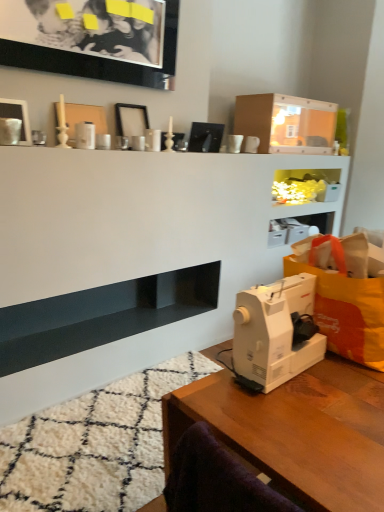
Looking at this image, in order to face orange fabric grocery bag at right, should I rotate leftwards or rightwards?

You should rotate right by 20.301 degrees.

Where is `orange fabric grocery bag at right`? The width and height of the screenshot is (384, 512). orange fabric grocery bag at right is located at coordinates (344, 295).

Where is `black glossy picture frame at upper left, marked as the 3th picture frame in a bottom-to-top arrangement`? This screenshot has width=384, height=512. black glossy picture frame at upper left, marked as the 3th picture frame in a bottom-to-top arrangement is located at coordinates (99, 60).

What do you see at coordinates (131, 120) in the screenshot?
I see `white matte picture frame at upper center, which ranks as the second picture frame in bottom-to-top order` at bounding box center [131, 120].

The width and height of the screenshot is (384, 512). I want to click on white glossy picture frame at upper left, which is counted as the third picture frame, starting from the top, so click(17, 117).

The image size is (384, 512). Describe the element at coordinates (296, 432) in the screenshot. I see `wooden table at lower right` at that location.

In order to face wooden table at lower right, should I rotate leftwards or rightwards?

You should rotate right by 13.479 degrees.

At what (x,y) coordinates should I click in order to perform the action: click on matte cardboard box at upper center. Please return your answer as a coordinate pair (x, y). Image resolution: width=384 pixels, height=512 pixels. Looking at the image, I should click on (286, 123).

From the image's perspective, between wooden table at lower right and translucent plastic cabinet at upper center, which one is located above?

translucent plastic cabinet at upper center, from the image's perspective.

Is wooden table at lower right completely or partially outside of translucent plastic cabinet at upper center?

That's correct, wooden table at lower right is outside of translucent plastic cabinet at upper center.

From a real-world perspective, is wooden table at lower right physically above translucent plastic cabinet at upper center?

No.

Which object is closer to the camera, wooden table at lower right or translucent plastic cabinet at upper center?

wooden table at lower right.

Considering the relative sizes of translucent plastic cabinet at upper center and white plastic sewing machine at lower right in the image provided, is translucent plastic cabinet at upper center taller than white plastic sewing machine at lower right?

Incorrect, the height of translucent plastic cabinet at upper center is not larger of that of white plastic sewing machine at lower right.

Who is smaller, translucent plastic cabinet at upper center or white plastic sewing machine at lower right?

Smaller between the two is white plastic sewing machine at lower right.

Between translucent plastic cabinet at upper center and white plastic sewing machine at lower right, which one appears on the right side from the viewer's perspective?

From the viewer's perspective, translucent plastic cabinet at upper center appears more on the right side.

Locate an element on the screen. This screenshot has width=384, height=512. sewing machine on the left of translucent plastic cabinet at upper center is located at coordinates [x=274, y=332].

Based on the photo, which point is more forward, (262, 335) or (330, 193)?

The point (262, 335) is in front.

Is white plastic sewing machine at lower right not near translucent plastic cabinet at upper center?

Indeed, white plastic sewing machine at lower right is not near translucent plastic cabinet at upper center.

Does white plastic sewing machine at lower right have a smaller size compared to translucent plastic cabinet at upper center?

Correct, white plastic sewing machine at lower right occupies less space than translucent plastic cabinet at upper center.

Is white plastic sewing machine at lower right not inside black glossy picture frame at upper left, marked as the 3th picture frame in a bottom-to-top arrangement?

Yes.

Can you confirm if white plastic sewing machine at lower right is thinner than black glossy picture frame at upper left, marked as the 3th picture frame in a bottom-to-top arrangement?

Incorrect, the width of white plastic sewing machine at lower right is not less than that of black glossy picture frame at upper left, marked as the 3th picture frame in a bottom-to-top arrangement.

Considering the points (278, 285) and (42, 48), which point is in front, point (278, 285) or point (42, 48)?

The point (278, 285) is closer.

Is white plastic sewing machine at lower right facing away from black glossy picture frame at upper left, the first picture frame viewed from the top?

No, white plastic sewing machine at lower right is not facing the opposite direction of black glossy picture frame at upper left, the first picture frame viewed from the top.

Based on their sizes in the image, would you say wooden table at lower right is bigger or smaller than black glossy picture frame at upper left, marked as the 3th picture frame in a bottom-to-top arrangement?

Clearly, wooden table at lower right is larger in size than black glossy picture frame at upper left, marked as the 3th picture frame in a bottom-to-top arrangement.

Is wooden table at lower right at the right side of black glossy picture frame at upper left, the first picture frame viewed from the top?

Correct, you'll find wooden table at lower right to the right of black glossy picture frame at upper left, the first picture frame viewed from the top.

Looking at their sizes, would you say wooden table at lower right is wider or thinner than black glossy picture frame at upper left, marked as the 3th picture frame in a bottom-to-top arrangement?

Considering their sizes, wooden table at lower right looks broader than black glossy picture frame at upper left, marked as the 3th picture frame in a bottom-to-top arrangement.

Is wooden table at lower right with black glossy picture frame at upper left, the first picture frame viewed from the top?

wooden table at lower right is not next to black glossy picture frame at upper left, the first picture frame viewed from the top, and they're not touching.

Who is smaller, translucent plastic cabinet at upper center or white glossy picture frame at upper left, which is counted as the third picture frame, starting from the top?

Smaller between the two is white glossy picture frame at upper left, which is counted as the third picture frame, starting from the top.

From a real-world perspective, which is physically above, translucent plastic cabinet at upper center or white glossy picture frame at upper left, which is counted as the third picture frame, starting from the top?

In real-world perspective, white glossy picture frame at upper left, which is counted as the third picture frame, starting from the top, is above.

Is white glossy picture frame at upper left, which is counted as the third picture frame, starting from the top, completely or partially inside translucent plastic cabinet at upper center?

No, white glossy picture frame at upper left, which is counted as the third picture frame, starting from the top, is not a part of translucent plastic cabinet at upper center.

You are a GUI agent. You are given a task and a screenshot of the screen. Output one action in this format:
    pyautogui.click(x=<x>, y=<y>)
    Task: Click on the cabinet on the right of the white glossy picture frame at upper left, which is counted as the third picture frame, starting from the top
    The image size is (384, 512).
    Given the screenshot: What is the action you would take?
    pyautogui.click(x=305, y=186)

From the image's perspective, does white matte picture frame at upper center, which ranks as the second picture frame in bottom-to-top order, appear lower than wooden table at lower right?

Actually, white matte picture frame at upper center, which ranks as the second picture frame in bottom-to-top order, appears above wooden table at lower right in the image.

How different are the orientations of white matte picture frame at upper center, the second picture frame from the top, and wooden table at lower right in degrees?

The angle between the facing direction of white matte picture frame at upper center, the second picture frame from the top, and the facing direction of wooden table at lower right is 94.1 degrees.

Which is more to the right, white matte picture frame at upper center, which ranks as the second picture frame in bottom-to-top order, or wooden table at lower right?

Positioned to the right is wooden table at lower right.

Between white matte picture frame at upper center, which ranks as the second picture frame in bottom-to-top order, and wooden table at lower right, which one has smaller width?

With smaller width is white matte picture frame at upper center, which ranks as the second picture frame in bottom-to-top order.

At what (x,y) coordinates should I click in order to perform the action: click on table below the translucent plastic cabinet at upper center (from the image's perspective). Please return your answer as a coordinate pair (x, y). Looking at the image, I should click on (296, 432).

Find the location of a particular element. The width and height of the screenshot is (384, 512). cabinet above the white plastic sewing machine at lower right (from a real-world perspective) is located at coordinates (305, 186).

Which object lies nearer to the anchor point translucent plastic cabinet at upper center, black glossy picture frame at upper left, marked as the 3th picture frame in a bottom-to-top arrangement, or orange fabric grocery bag at right?

black glossy picture frame at upper left, marked as the 3th picture frame in a bottom-to-top arrangement, lies closer to translucent plastic cabinet at upper center than the other object.

Which object lies further to the anchor point black glossy picture frame at upper left, the first picture frame viewed from the top, translucent plastic cabinet at upper center or white glossy picture frame at upper left, which is counted as the third picture frame, starting from the top?

translucent plastic cabinet at upper center is further to black glossy picture frame at upper left, the first picture frame viewed from the top.

Looking at the image, which one is located closer to white plastic sewing machine at lower right, black glossy picture frame at upper left, marked as the 3th picture frame in a bottom-to-top arrangement, or translucent plastic cabinet at upper center?

Based on the image, black glossy picture frame at upper left, marked as the 3th picture frame in a bottom-to-top arrangement, appears to be nearer to white plastic sewing machine at lower right.

From the image, which object appears to be nearer to matte cardboard box at upper center, white plastic sewing machine at lower right or translucent plastic cabinet at upper center?

Among the two, translucent plastic cabinet at upper center is located nearer to matte cardboard box at upper center.

Looking at the image, which one is located further to translucent plastic cabinet at upper center, orange fabric grocery bag at right or matte cardboard box at upper center?

The object further to translucent plastic cabinet at upper center is orange fabric grocery bag at right.

Consider the image. Based on their spatial positions, is white glossy picture frame at upper left, which is counted as the third picture frame, starting from the top, or matte cardboard box at upper center closer to orange fabric grocery bag at right?

The object closer to orange fabric grocery bag at right is white glossy picture frame at upper left, which is counted as the third picture frame, starting from the top.

Estimate the real-world distances between objects in this image. Which object is closer to translucent plastic cabinet at upper center, white matte picture frame at upper center, the second picture frame from the top, or orange fabric grocery bag at right?

Based on the image, white matte picture frame at upper center, the second picture frame from the top, appears to be nearer to translucent plastic cabinet at upper center.

Which object lies further to the anchor point wooden table at lower right, white matte picture frame at upper center, which ranks as the second picture frame in bottom-to-top order, or orange fabric grocery bag at right?

white matte picture frame at upper center, which ranks as the second picture frame in bottom-to-top order, is further to wooden table at lower right.

At what (x,y) coordinates should I click in order to perform the action: click on sewing machine between wooden table at lower right and white matte picture frame at upper center, which ranks as the second picture frame in bottom-to-top order, from front to back. Please return your answer as a coordinate pair (x, y). This screenshot has width=384, height=512. Looking at the image, I should click on (274, 332).

Image resolution: width=384 pixels, height=512 pixels. In order to click on sewing machine between black glossy picture frame at upper left, marked as the 3th picture frame in a bottom-to-top arrangement, and wooden table at lower right vertically in this screenshot , I will do `click(274, 332)`.

You are a GUI agent. You are given a task and a screenshot of the screen. Output one action in this format:
    pyautogui.click(x=<x>, y=<y>)
    Task: Click on the sewing machine positioned between wooden table at lower right and matte cardboard box at upper center from near to far
    This screenshot has width=384, height=512.
    Given the screenshot: What is the action you would take?
    pyautogui.click(x=274, y=332)

The height and width of the screenshot is (512, 384). Identify the location of picture frame between black glossy picture frame at upper left, marked as the 3th picture frame in a bottom-to-top arrangement, and white matte picture frame at upper center, the second picture frame from the top, in the front-back direction. (17, 117).